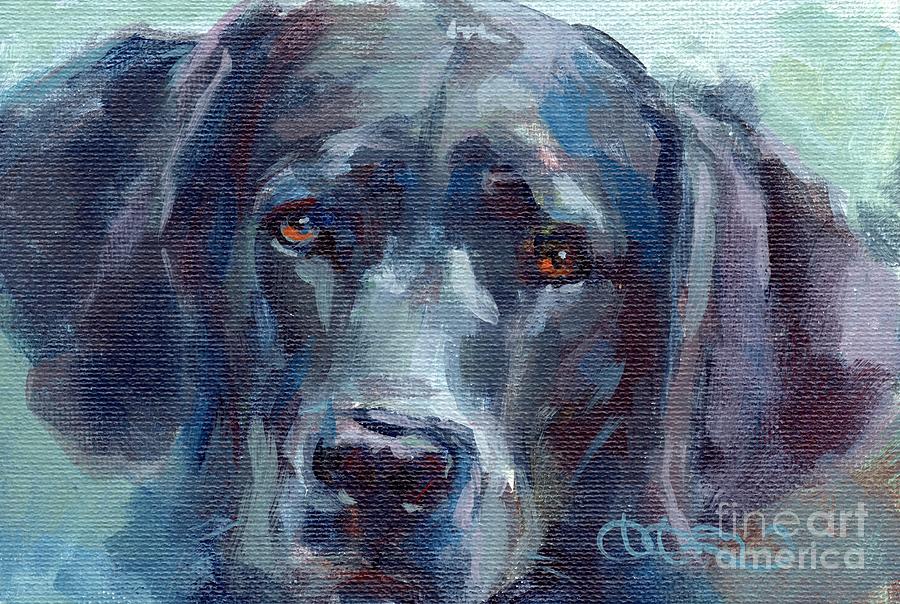
The width and height of the screenshot is (900, 604). Find the location of `green paint`. green paint is located at coordinates (839, 108).